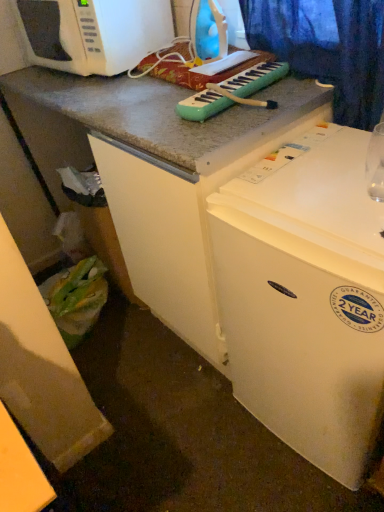
Question: Looking at their shapes, would you say teal plastic musical keyboard at center is wider or thinner than transparent glass at upper right?

Choices:
 (A) thin
 (B) wide

Answer: (B)

Question: Relative to transparent glass at upper right, is teal plastic musical keyboard at center in front or behind?

Choices:
 (A) behind
 (B) front

Answer: (A)

Question: Estimate the real-world distances between objects in this image. Which object is closer to the transparent glass at upper right?

Choices:
 (A) teal plastic musical keyboard at center
 (B) white matte refrigerator at upper right
 (C) smooth white countertop at lower left
 (D) white matte microwave oven at upper left

Answer: (B)

Question: Which object is positioned farthest from the white matte microwave oven at upper left?

Choices:
 (A) white matte refrigerator at upper right
 (B) transparent glass at upper right
 (C) smooth white countertop at lower left
 (D) teal plastic musical keyboard at center

Answer: (C)